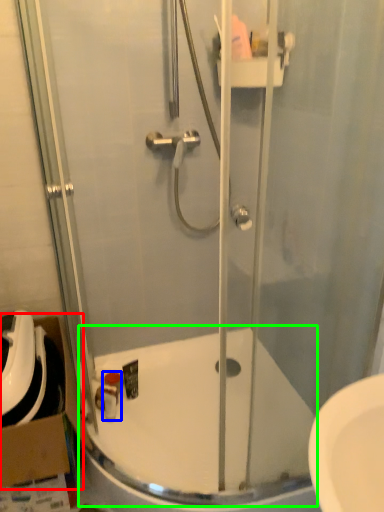
Question: Which object is the closest to the cardboard box (highlighted by a red box)? Choose among these: toiletry (highlighted by a blue box) or bath (highlighted by a green box).

Choices:
 (A) toiletry
 (B) bath

Answer: (A)